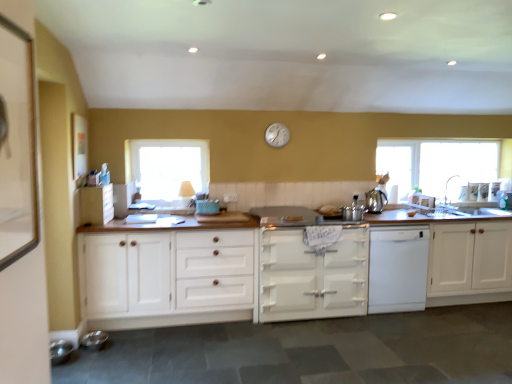
Question: Considering the relative positions of white wood cabinet at center, the third cabinetry when ordered from right to left, and metallic silver pots at center, placed as the third appliance when sorted from bottom to top, in the image provided, is white wood cabinet at center, the third cabinetry when ordered from right to left, to the left of metallic silver pots at center, placed as the third appliance when sorted from bottom to top, from the viewer's perspective?

Choices:
 (A) no
 (B) yes

Answer: (B)

Question: Does white wood cabinet at center, the third cabinetry when ordered from right to left, turn towards metallic silver pots at center, which is counted as the first appliance, starting from the top?

Choices:
 (A) yes
 (B) no

Answer: (B)

Question: Would you consider white wood cabinet at center, which is counted as the 2th cabinetry, starting from the left, to be distant from metallic silver pots at center, which is counted as the first appliance, starting from the top?

Choices:
 (A) yes
 (B) no

Answer: (A)

Question: Is metallic silver pots at center, placed as the third appliance when sorted from bottom to top, at the back of white wood cabinet at center, which is counted as the 2th cabinetry, starting from the left?

Choices:
 (A) no
 (B) yes

Answer: (A)

Question: From a real-world perspective, is white wood cabinet at center, which is counted as the 2th cabinetry, starting from the left, located higher than metallic silver pots at center, which ranks as the first appliance in back-to-front order?

Choices:
 (A) yes
 (B) no

Answer: (B)

Question: Visually, is shiny metallic kettle at right positioned to the left or to the right of white matte dishwasher at center?

Choices:
 (A) left
 (B) right

Answer: (A)

Question: Looking at their shapes, would you say shiny metallic kettle at right is wider or thinner than white matte dishwasher at center?

Choices:
 (A) thin
 (B) wide

Answer: (A)

Question: From a real-world perspective, is shiny metallic kettle at right positioned above or below white matte dishwasher at center?

Choices:
 (A) above
 (B) below

Answer: (A)

Question: Is point (373, 190) closer or farther from the camera than point (374, 253)?

Choices:
 (A) farther
 (B) closer

Answer: (A)

Question: Considering the positions of transparent glass window at right, placed as the first window when sorted from right to left, and transparent glass window at center, the 2th window when ordered from back to front, in the image, is transparent glass window at right, placed as the first window when sorted from right to left, bigger or smaller than transparent glass window at center, the 2th window when ordered from back to front,?

Choices:
 (A) big
 (B) small

Answer: (A)

Question: From a real-world perspective, is transparent glass window at right, placed as the first window when sorted from right to left, positioned above or below transparent glass window at center, acting as the second window starting from the right?

Choices:
 (A) below
 (B) above

Answer: (B)

Question: In terms of height, does transparent glass window at right, which appears as the first window when viewed from the back, look taller or shorter compared to transparent glass window at center, marked as the first window in a left-to-right arrangement?

Choices:
 (A) tall
 (B) short

Answer: (A)

Question: Is transparent glass window at right, the second window in the left-to-right sequence, spatially inside transparent glass window at center, the 2th window when ordered from back to front, or outside of it?

Choices:
 (A) outside
 (B) inside

Answer: (A)

Question: Based on their sizes in the image, would you say white wood cabinet at center, the third cabinetry when ordered from right to left, is bigger or smaller than white plastic clock at upper center?

Choices:
 (A) small
 (B) big

Answer: (B)

Question: Does point (100, 236) appear closer or farther from the camera than point (269, 130)?

Choices:
 (A) farther
 (B) closer

Answer: (B)